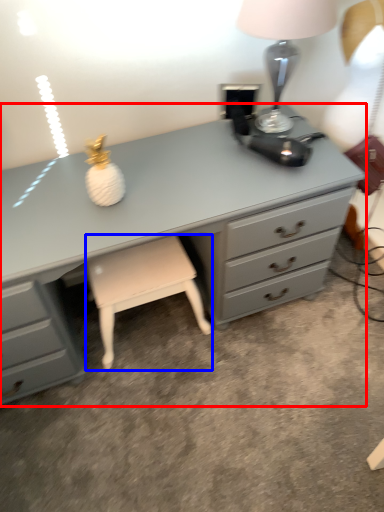
Question: Which of the following is the closest to the observer, chest of drawers (highlighted by a red box) or stool (highlighted by a blue box)?

Choices:
 (A) chest of drawers
 (B) stool

Answer: (A)